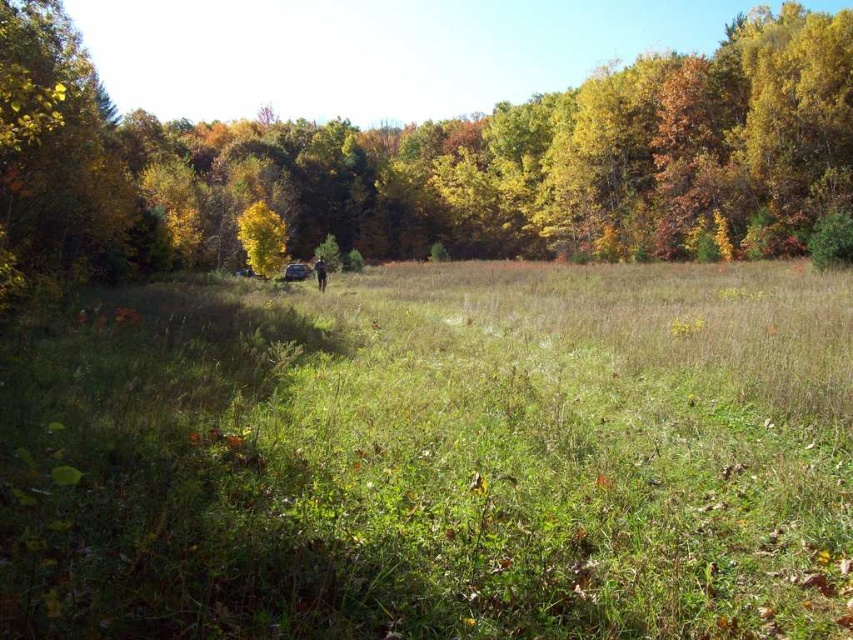
You are standing in the autumn landscape and want to walk from the green grassy field at center to the yellow leafy tree at center. Which direction should you go to reach the tree?

The green grassy field at center is located at the base of the yellow leafy tree at center, so you should walk towards the direction where the tree stands to reach it.